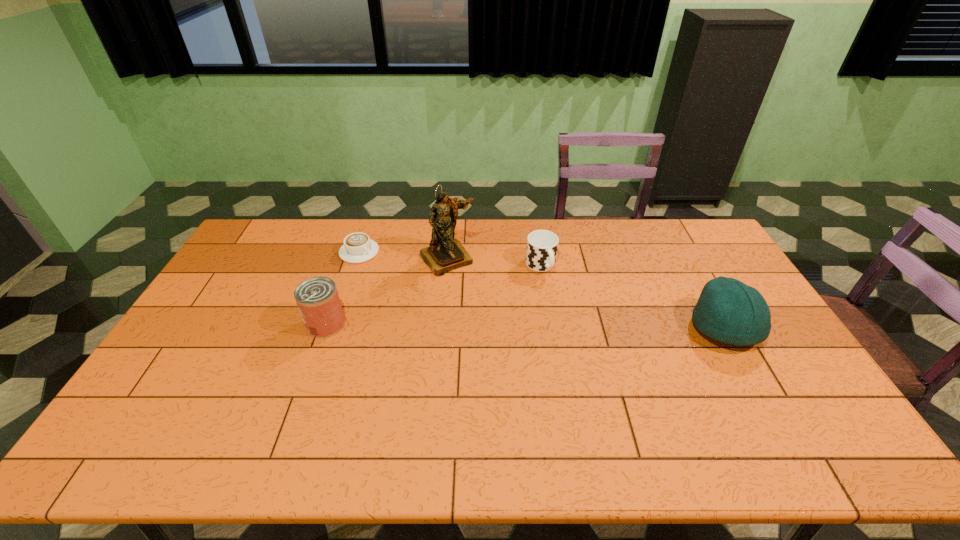
The height and width of the screenshot is (540, 960). What are the coordinates of `vacant spot on the desktop that is between the can and the rightmost object and is positioned on the side of the fourth tallest object with the handle` in the screenshot? It's located at (581, 327).

Where is `free space on the desktop that is between the can and the rightmost object and is positioned on the front-facing side of the tallest object`? This screenshot has width=960, height=540. free space on the desktop that is between the can and the rightmost object and is positioned on the front-facing side of the tallest object is located at coordinates (495, 326).

You are a GUI agent. You are given a task and a screenshot of the screen. Output one action in this format:
    pyautogui.click(x=<x>, y=<y>)
    Task: Click on the free space on the desktop that is between the can and the rightmost object and is positioned with the handle on the right side of the cappuccino
    Image resolution: width=960 pixels, height=540 pixels.
    Given the screenshot: What is the action you would take?
    pyautogui.click(x=492, y=326)